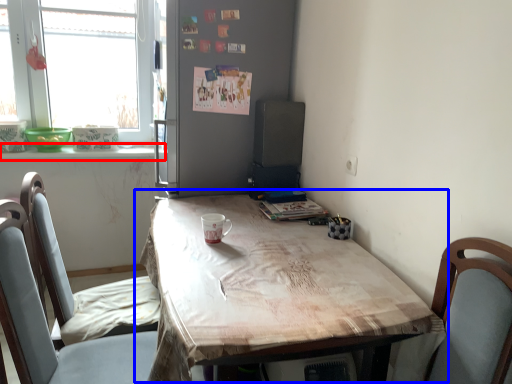
Question: Which object appears closest to the camera in this image, window sill (highlighted by a red box) or table (highlighted by a blue box)?

Choices:
 (A) window sill
 (B) table

Answer: (B)